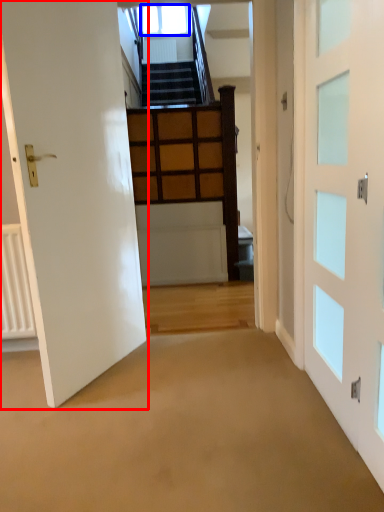
Question: Which of the following is the closest to the observer, door (highlighted by a red box) or window (highlighted by a blue box)?

Choices:
 (A) door
 (B) window

Answer: (A)